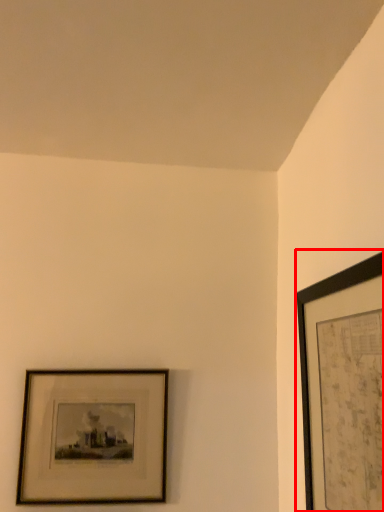
Question: Considering the relative positions of picture frame (annotated by the red box) and picture frame in the image provided, where is picture frame (annotated by the red box) located with respect to the staircase?

Choices:
 (A) right
 (B) left

Answer: (A)